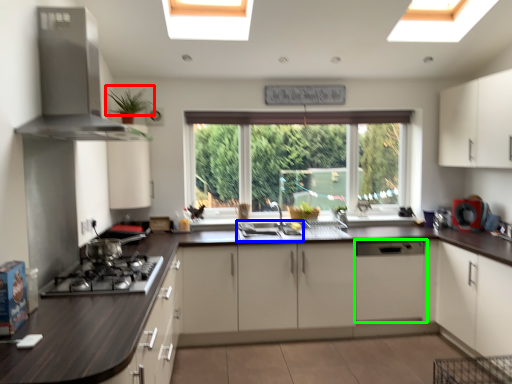
Question: Based on their relative distances, which object is nearer to plant (highlighted by a red box)? Choose from sink (highlighted by a blue box) and cabinetry (highlighted by a green box).

Choices:
 (A) sink
 (B) cabinetry

Answer: (A)